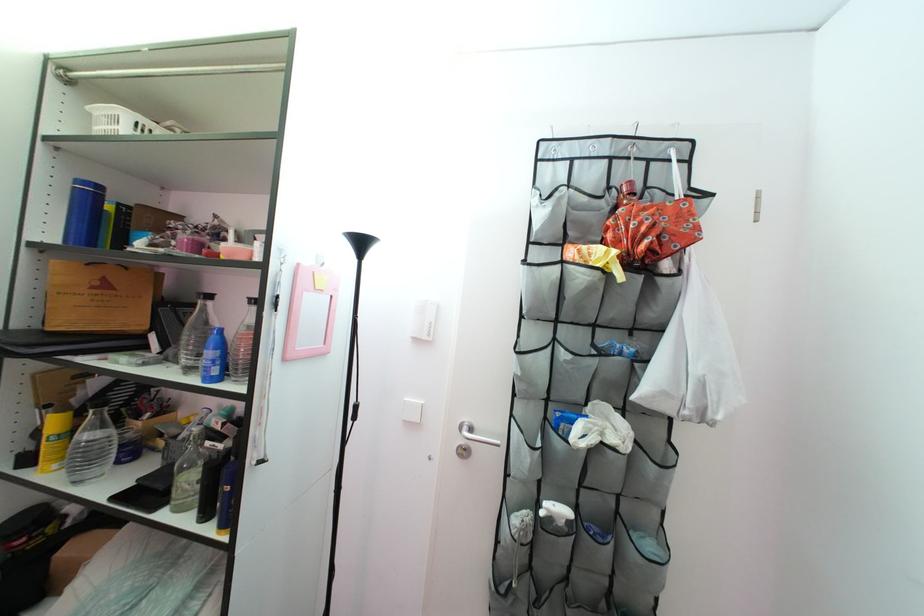
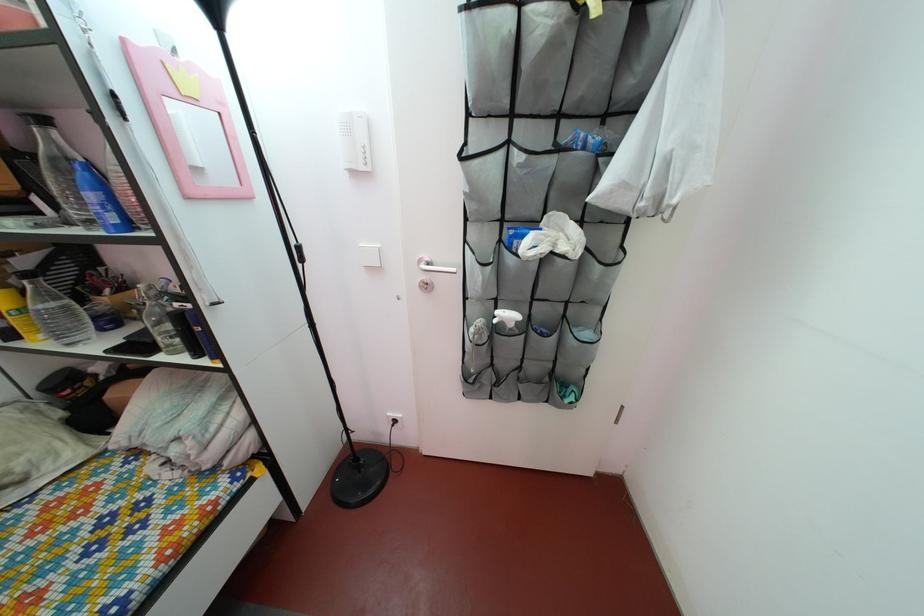
Find the pixel in the second image that matches the point at 484,432 in the first image.

(443, 268)